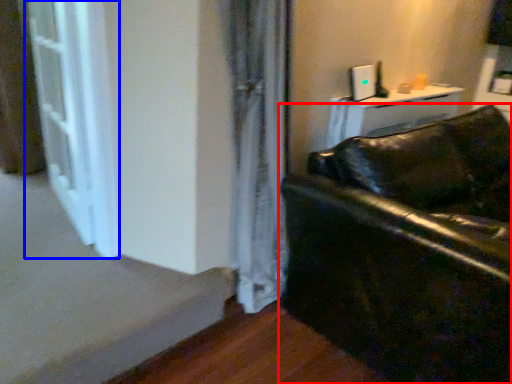
Question: Which object appears closest to the camera in this image, studio couch (highlighted by a red box) or screen door (highlighted by a blue box)?

Choices:
 (A) studio couch
 (B) screen door

Answer: (A)